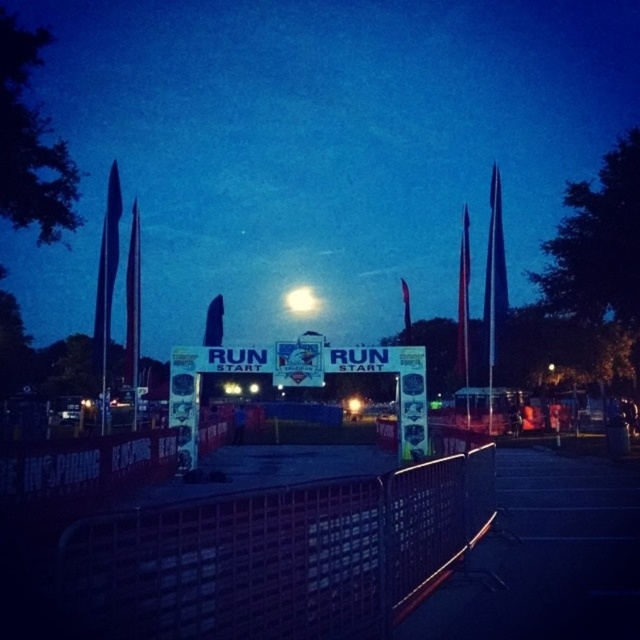
Question: Which point appears farthest from the camera in this image?

Choices:
 (A) (316, 304)
 (B) (173, 392)
 (C) (112, 540)

Answer: (A)

Question: Considering the real-world distances, which object is closest to the white paper sign at center?

Choices:
 (A) metallic mesh fence at center
 (B) bright white orb at center

Answer: (A)

Question: Which object is closer to the camera taking this photo?

Choices:
 (A) metallic mesh fence at center
 (B) white paper sign at center

Answer: (A)

Question: Can you confirm if metallic mesh fence at center is positioned below bright white orb at center?

Choices:
 (A) yes
 (B) no

Answer: (A)

Question: Is metallic mesh fence at center smaller than white paper sign at center?

Choices:
 (A) yes
 (B) no

Answer: (B)

Question: Does metallic mesh fence at center have a lesser width compared to bright white orb at center?

Choices:
 (A) yes
 (B) no

Answer: (B)